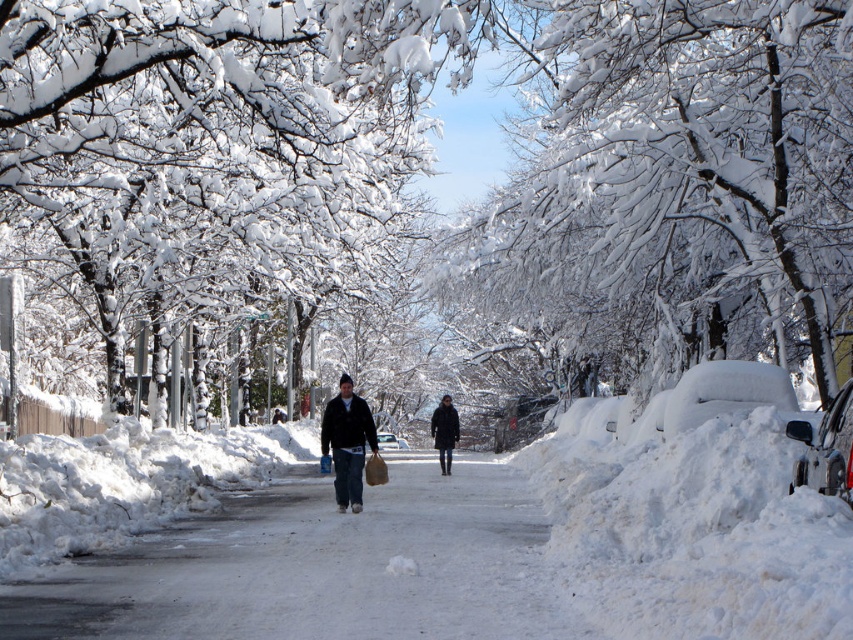
Question: Can you confirm if white snow-covered tree at center is positioned above dark gray wool coat at center?

Choices:
 (A) no
 (B) yes

Answer: (B)

Question: Which of the following is the closest to the observer?

Choices:
 (A) silver metallic car at right
 (B) white snow-covered tree at center
 (C) dark gray wool coat at center
 (D) dark blue denim jacket at center

Answer: (A)

Question: Which of the following is the farthest from the observer?

Choices:
 (A) dark gray wool coat at center
 (B) silver metallic car at right
 (C) white snow-covered pavement at center
 (D) dark blue denim jacket at center

Answer: (A)

Question: Can you confirm if white snow-covered tree at center is bigger than silver metallic car at right?

Choices:
 (A) no
 (B) yes

Answer: (B)

Question: Is silver metallic car at right thinner than dark gray wool coat at center?

Choices:
 (A) yes
 (B) no

Answer: (B)

Question: Which point is farther to the camera?

Choices:
 (A) white snow-covered pavement at center
 (B) white snow-covered tree at center

Answer: (B)